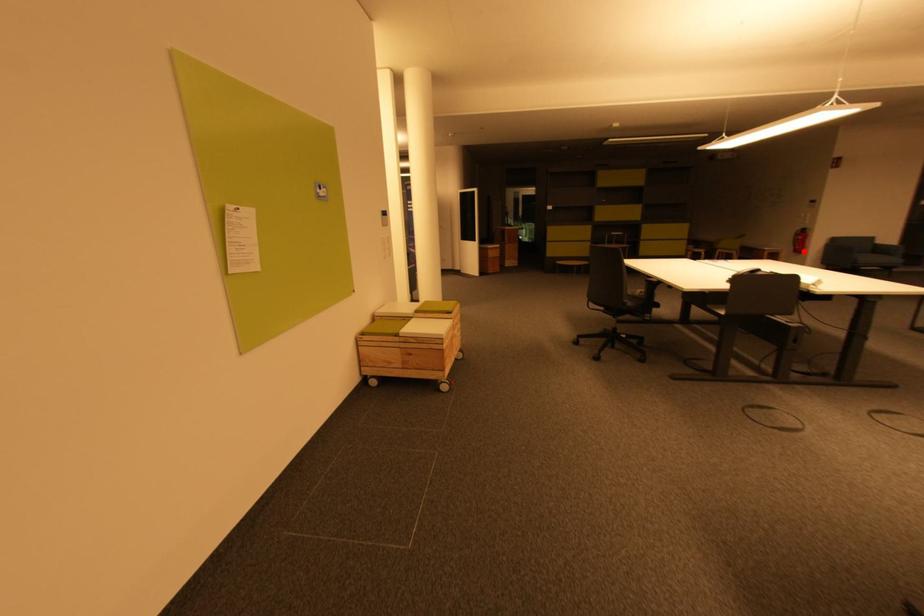
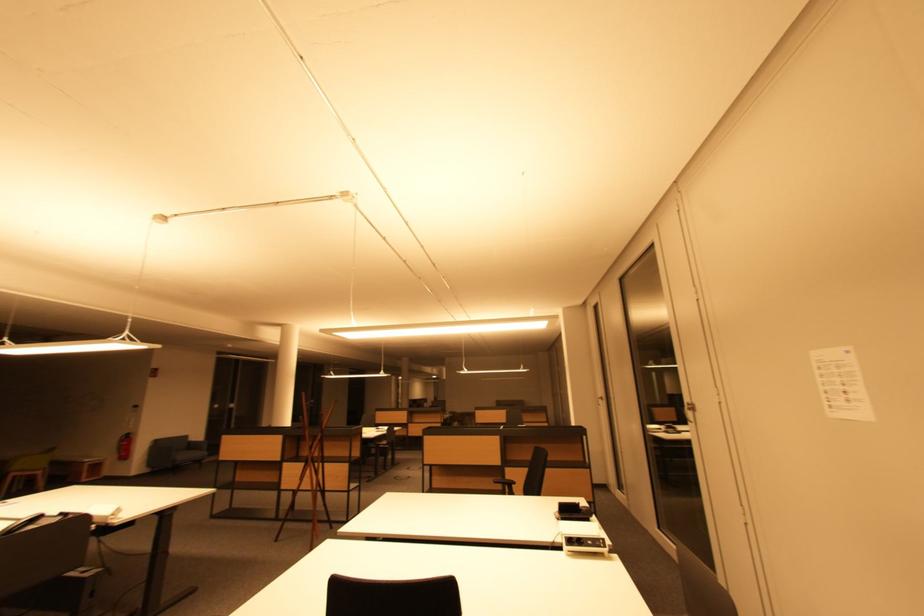
Question: A red point is marked in image1. In image2, is the corresponding 3D point closer to the camera or farther? Reply with the corresponding letter.

Choices:
 (A) The corresponding 3D point is closer.
 (B) The corresponding 3D point is farther.

Answer: (A)